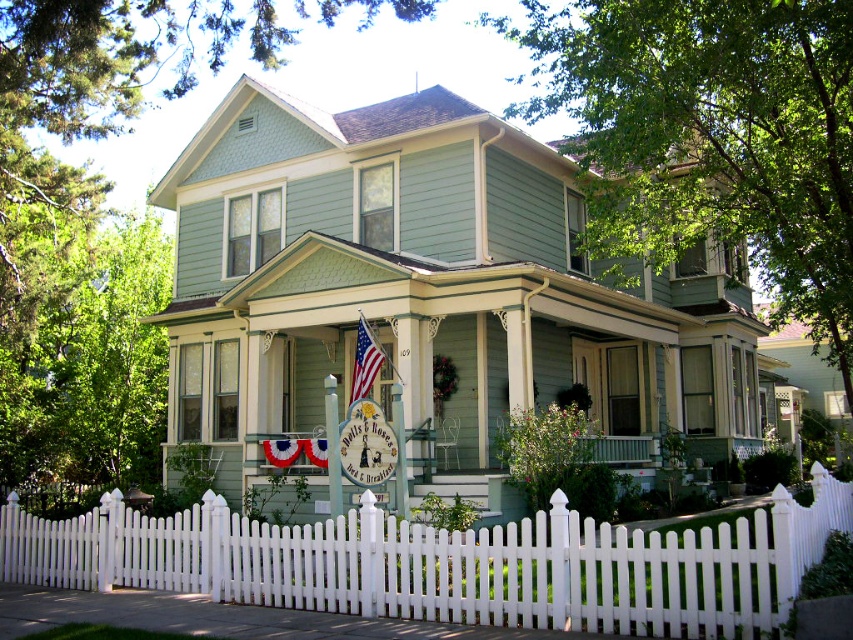
Question: Does white picket fence at lower center have a smaller size compared to american flag at center?

Choices:
 (A) yes
 (B) no

Answer: (B)

Question: Which point is closer to the camera?

Choices:
 (A) (776, 516)
 (B) (357, 380)

Answer: (A)

Question: Is white picket fence at lower center wider than american flag at center?

Choices:
 (A) no
 (B) yes

Answer: (B)

Question: Can you confirm if white picket fence at lower center is positioned to the right of american flag at center?

Choices:
 (A) no
 (B) yes

Answer: (B)

Question: Which of the following is the closest to the observer?

Choices:
 (A) [x=358, y=376]
 (B) [x=759, y=625]

Answer: (B)